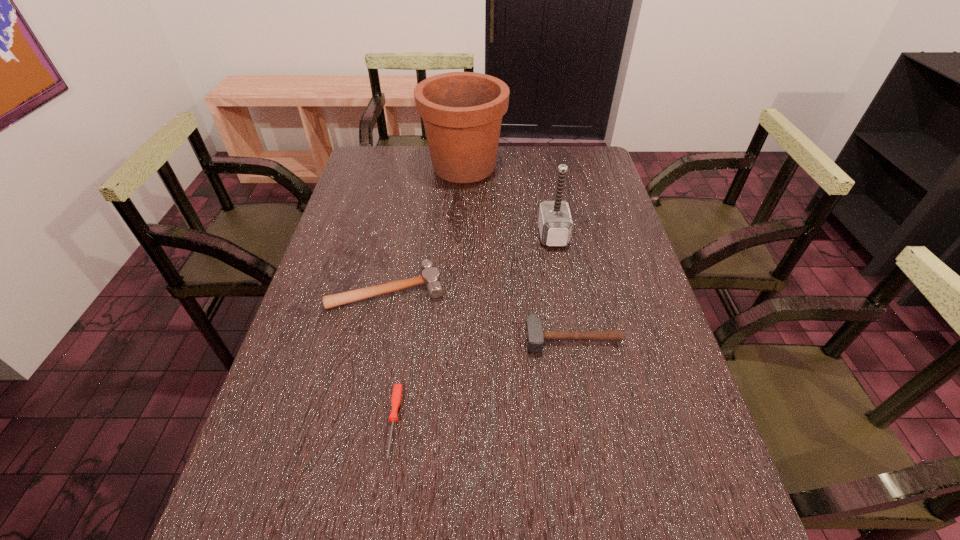
Identify the location of vacant space located 0.140m for striking with the head of the second farthest object. The width and height of the screenshot is (960, 540). (494, 235).

Identify the location of vacant area located for striking with the head of the second farthest object. (491, 235).

Locate an element on the screen. The image size is (960, 540). vacant point located for striking with the head of the second farthest object is located at coordinates click(494, 235).

The image size is (960, 540). I want to click on free space located on the front of the second farthest hammer, so click(352, 456).

At what (x,y) coordinates should I click in order to perform the action: click on vacant area situated on the striking surface of the nearest hammer. Please return your answer as a coordinate pair (x, y). Looking at the image, I should click on (581, 387).

Locate an element on the screen. This screenshot has width=960, height=540. vacant area situated at the tip of the nearest object is located at coordinates (382, 504).

This screenshot has width=960, height=540. Identify the location of object present at the far edge. (462, 112).

Image resolution: width=960 pixels, height=540 pixels. I want to click on object that is positioned at the left edge, so click(x=430, y=277).

I want to click on object that is positioned at the right edge, so click(535, 336).

In the image, there is a desktop. At what (x,y) coordinates should I click in order to perform the action: click on vacant space at the far edge. Please return your answer as a coordinate pair (x, y). This screenshot has height=540, width=960. Looking at the image, I should click on (426, 166).